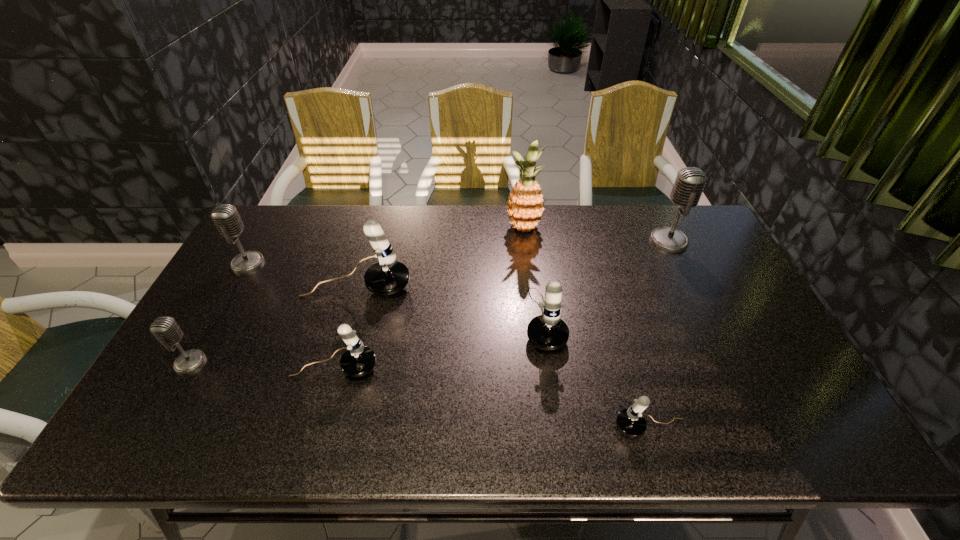
Image resolution: width=960 pixels, height=540 pixels. In order to click on microphone that is positioned at the far edge in this screenshot , I will do `click(690, 182)`.

At what (x,y) coordinates should I click in order to perform the action: click on object that is at the near edge. Please return your answer as a coordinate pair (x, y). This screenshot has height=540, width=960. Looking at the image, I should click on (630, 422).

Where is `object that is at the right edge`? Image resolution: width=960 pixels, height=540 pixels. object that is at the right edge is located at coordinates (690, 182).

Identify the location of object present at the far right corner. This screenshot has height=540, width=960. (690, 182).

Identify the location of vacant space at the far edge of the desktop. This screenshot has width=960, height=540. [x=569, y=209].

The image size is (960, 540). What are the coordinates of `vacant area at the near edge of the desktop` in the screenshot? It's located at (252, 423).

In the image, there is a desktop. In order to click on vacant space at the far left corner in this screenshot , I will do point(275,239).

The image size is (960, 540). In the image, there is a desktop. Identify the location of vacant space at the near right corner. (764, 439).

This screenshot has width=960, height=540. What are the coordinates of `vacant space that is in between the second smallest white microphone and the smallest gray microphone` in the screenshot? It's located at (263, 365).

This screenshot has height=540, width=960. What are the coordinates of `unoccupied position between the shortest microphone and the biggest white microphone` in the screenshot? It's located at (504, 357).